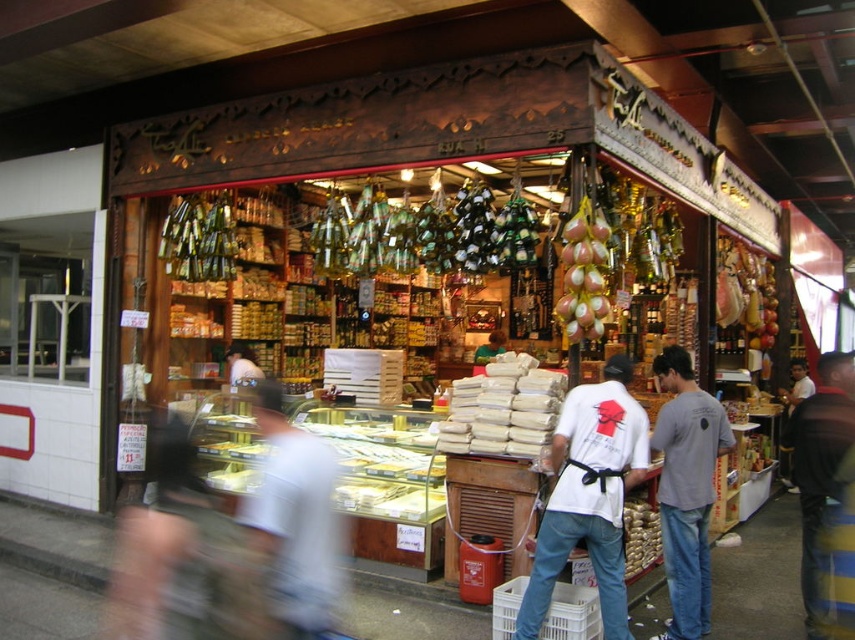
Describe the element at coordinates (502, 408) in the screenshot. The height and width of the screenshot is (640, 855). I see `white matte food at center` at that location.

Where is `white matte food at center`? The height and width of the screenshot is (640, 855). white matte food at center is located at coordinates (502, 408).

Between point (323, 490) and point (632, 540), which one is positioned in front?

Positioned in front is point (323, 490).

Does white cotton shirt at center appear on the left side of smooth brown bagel at lower center?

Correct, you'll find white cotton shirt at center to the left of smooth brown bagel at lower center.

What do you see at coordinates (293, 525) in the screenshot? The image size is (855, 640). I see `white cotton shirt at center` at bounding box center [293, 525].

Find the location of a particular element. white cotton shirt at center is located at coordinates (293, 525).

Is white matte shirt at center taller than white cotton shirt at center?

Indeed, white matte shirt at center has a greater height compared to white cotton shirt at center.

Does white matte shirt at center have a smaller size compared to white cotton shirt at center?

No.

Is point (615, 355) less distant than point (305, 481)?

No, (615, 355) is behind (305, 481).

You are a GUI agent. You are given a task and a screenshot of the screen. Output one action in this format:
    pyautogui.click(x=<x>, y=<y>)
    Task: Click on the white matte shirt at center
    
    Given the screenshot: What is the action you would take?
    pyautogui.click(x=588, y=497)